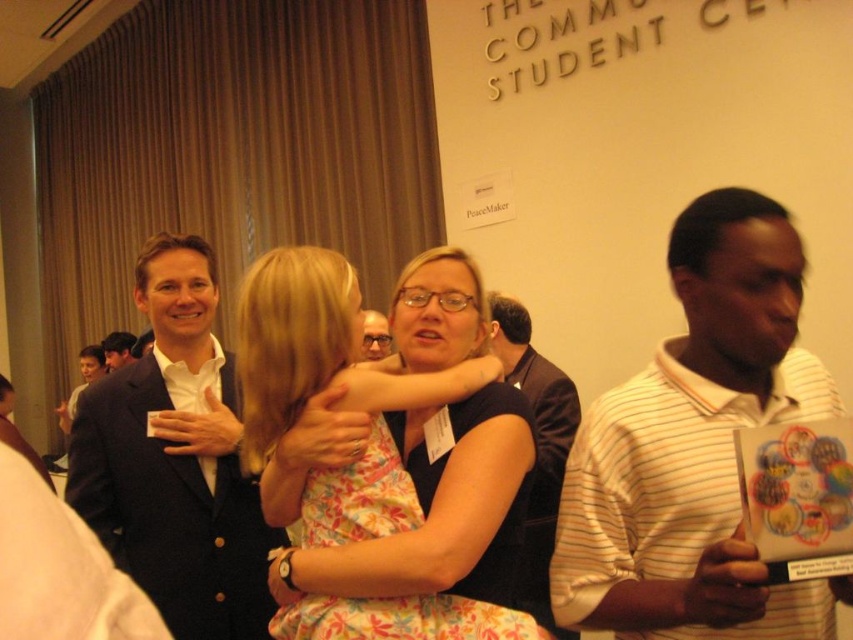
Question: Where is white striped polo shirt at right located in relation to dark suit at center in the image?

Choices:
 (A) right
 (B) left

Answer: (A)

Question: Is matte black dress at center below dark brown suit at center?

Choices:
 (A) yes
 (B) no

Answer: (B)

Question: Which object is positioned closest to the matte black dress at center?

Choices:
 (A) dark suit at center
 (B) dark blue suit at center
 (C) white striped polo shirt at right
 (D) matte black suit at center

Answer: (C)

Question: Which object is closer to the camera taking this photo?

Choices:
 (A) dark suit at center
 (B) matte black suit at center

Answer: (B)

Question: From the image, what is the correct spatial relationship of matte black dress at center in relation to dark brown suit at center?

Choices:
 (A) right
 (B) left

Answer: (B)

Question: Among these objects, which one is nearest to the camera?

Choices:
 (A) white striped polo shirt at right
 (B) dark blue suit at center

Answer: (A)